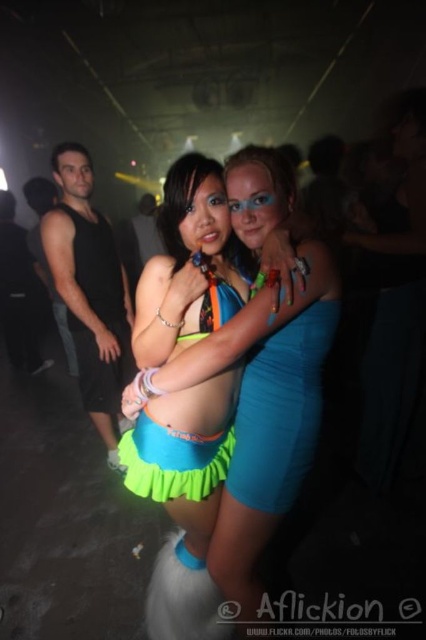
Is neon green fabric skirt at center positioned in front of neon blue fabric dress at center?

Yes, it is in front of neon blue fabric dress at center.

Which is more to the left, neon green fabric skirt at center or neon blue fabric dress at center?

From the viewer's perspective, neon blue fabric dress at center appears more on the left side.

In order to click on neon green fabric skirt at center in this screenshot , I will do `click(259, 374)`.

You are a GUI agent. You are given a task and a screenshot of the screen. Output one action in this format:
    pyautogui.click(x=<x>, y=<y>)
    Task: Click on the neon green fabric skirt at center
    Image resolution: width=426 pixels, height=640 pixels.
    Given the screenshot: What is the action you would take?
    pyautogui.click(x=259, y=374)